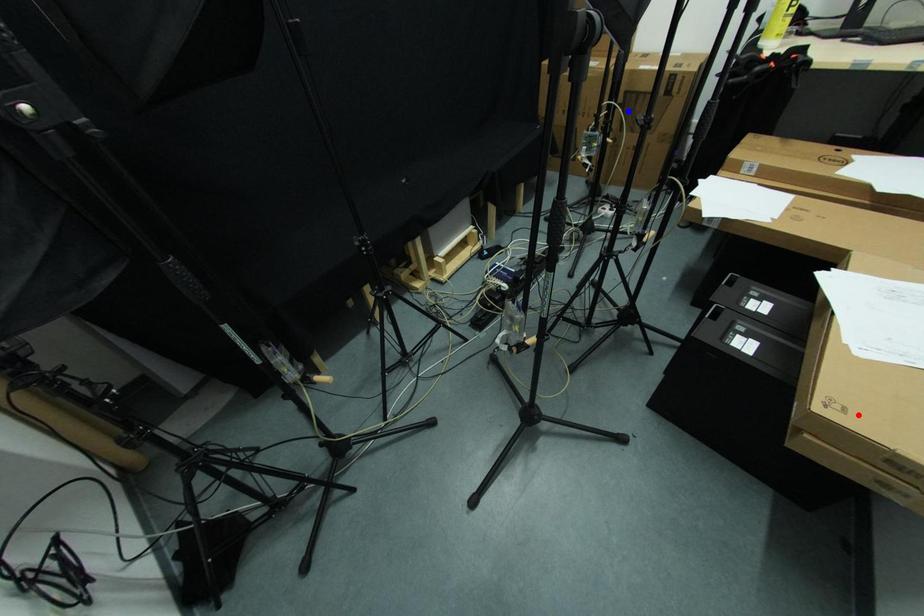
Question: Two points are marked on the image. Which point is closer to the camera?

Choices:
 (A) Blue point is closer.
 (B) Red point is closer.

Answer: (B)